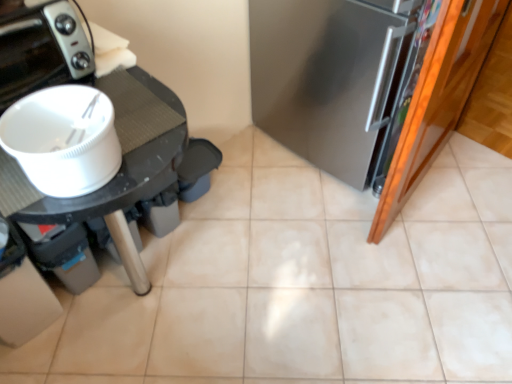
I want to click on free point in front of satin silver refrigerator at right, so click(350, 233).